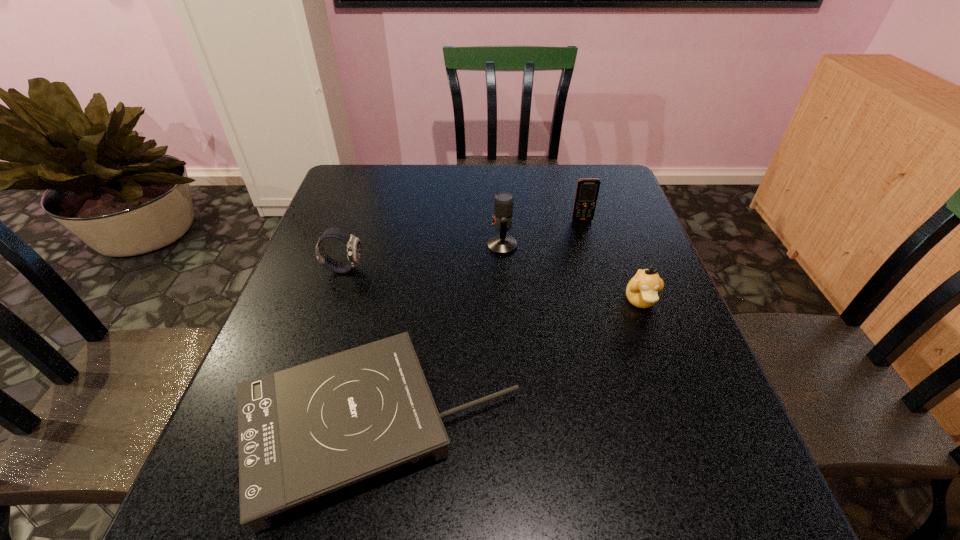
Locate an element on the screen. This screenshot has height=540, width=960. blank area located on the side of the microphone with the red ring is located at coordinates (357, 246).

Find the location of a particular element. Image resolution: width=960 pixels, height=540 pixels. blank space located 0.310m on the screen of the cellular telephone is located at coordinates (605, 299).

The image size is (960, 540). In order to click on vacant position located 0.200m on the face of the third nearest object in this screenshot , I will do `click(443, 269)`.

Where is `free spot located 0.390m on the face of the duckling`? Image resolution: width=960 pixels, height=540 pixels. free spot located 0.390m on the face of the duckling is located at coordinates (713, 498).

The height and width of the screenshot is (540, 960). I want to click on vacant area situated on the back of the nearest object, so click(402, 291).

Find the location of a particular element. Image resolution: width=960 pixels, height=540 pixels. object present at the near edge is located at coordinates (303, 432).

Identify the location of watch at the left edge. The height and width of the screenshot is (540, 960). (354, 250).

Locate an element on the screen. hotplate that is at the left edge is located at coordinates (303, 432).

Identify the location of cellular telephone present at the right edge. (587, 190).

Image resolution: width=960 pixels, height=540 pixels. Find the location of `duckling positioned at the right edge`. duckling positioned at the right edge is located at coordinates (642, 290).